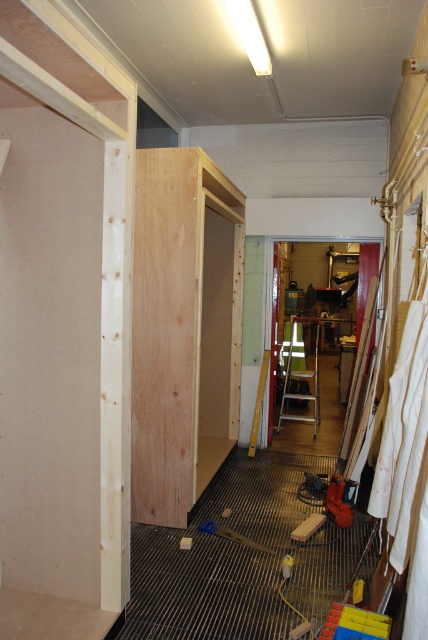
Question: Is the position of natural wood panel at center more distant than that of wooden plank at center?

Choices:
 (A) no
 (B) yes

Answer: (B)

Question: Among these points, which one is farthest from the camera?

Choices:
 (A) (252, 545)
 (B) (300, 371)
 (C) (169, 253)

Answer: (B)

Question: Which object appears closest to the camera in this image?

Choices:
 (A) wooden step ladder at center
 (B) wooden plank at center

Answer: (B)

Question: From the image, what is the correct spatial relationship of wooden step ladder at center in relation to wooden plank at center?

Choices:
 (A) right
 (B) left

Answer: (A)

Question: From the image, what is the correct spatial relationship of wooden step ladder at center in relation to wooden plank at center?

Choices:
 (A) below
 (B) above

Answer: (B)

Question: Among these points, which one is nearest to the camera?

Choices:
 (A) (290, 342)
 (B) (231, 534)

Answer: (B)